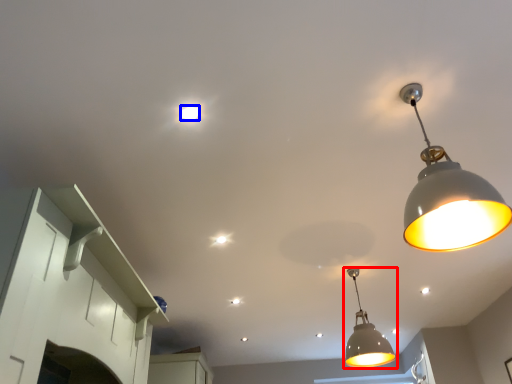
Question: Which point is further to the camera, lamp (highlighted by a red box) or light bulb (highlighted by a blue box)?

Choices:
 (A) lamp
 (B) light bulb

Answer: (A)